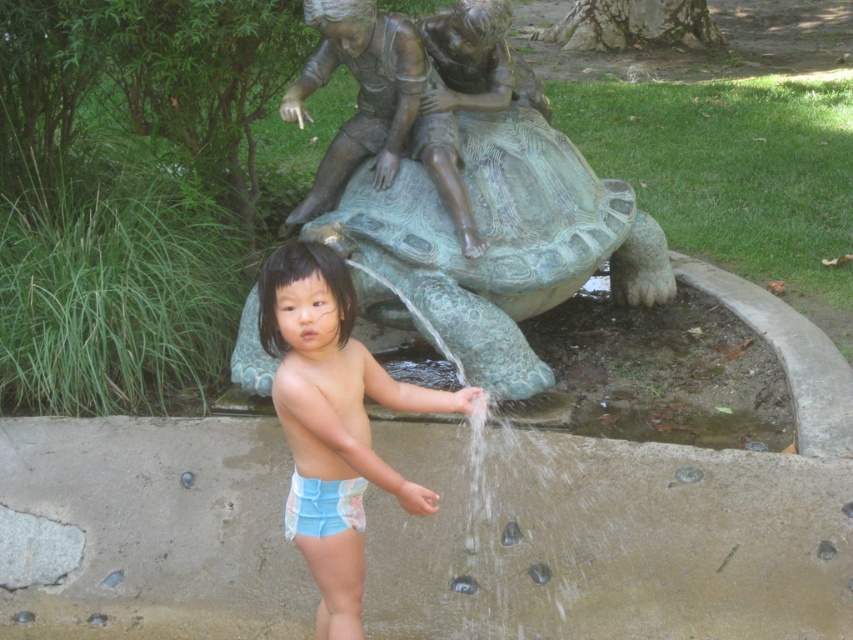
You are a photographer standing in front of the statue and want to take a photo of the blue fabric shorts at center and bronze textured turtle at center. Which object should you focus on first to ensure both are in focus?

You should focus on the bronze textured turtle at center first because it is farther away from the viewer than the blue fabric shorts at center, ensuring both will be in focus when using a camera with depth of field considerations.

You are a photographer trying to capture the child in the scene. The blue fabric shorts at center are at coordinates point 0.659, 0.392. If you want to frame the shot so the turtle statue is directly behind the child, would the turtle statue be visible in the frame?

The blue fabric shorts at center is located at point (334, 420). Since the turtle statue is positioned behind the child in the scene, it should be visible in the frame when focusing on the child wearing the blue fabric shorts at center.